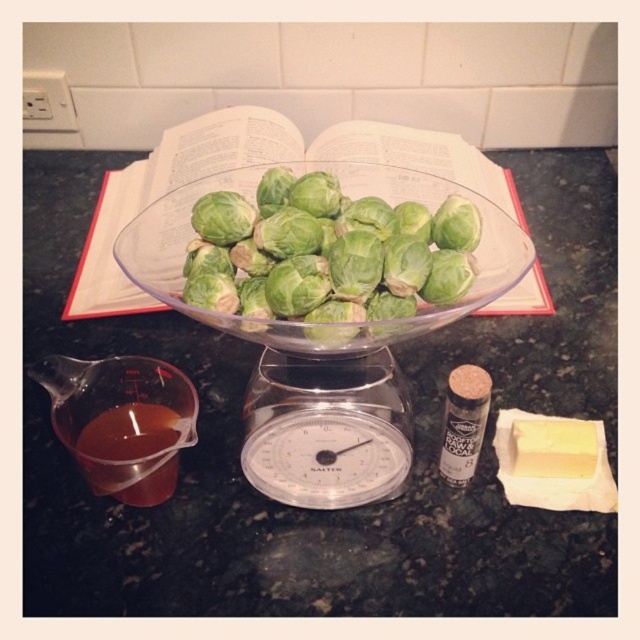
Question: Which point appears farthest from the camera in this image?

Choices:
 (A) (148, 394)
 (B) (506, 250)
 (C) (156, 445)
 (D) (291, 504)

Answer: (A)

Question: Does transparent plastic at center appear under translucent plastic measuring cup at lower left?

Choices:
 (A) yes
 (B) no

Answer: (A)

Question: Can you confirm if green leafy brussels sprouts at center is positioned below translucent amber liquid at lower left?

Choices:
 (A) no
 (B) yes

Answer: (A)

Question: Estimate the real-world distances between objects in this image. Which object is closer to the green leafy brussels sprouts at center?

Choices:
 (A) transparent plastic at center
 (B) green paper at center
 (C) translucent amber liquid at lower left

Answer: (A)

Question: Which of these objects is positioned farthest from the transparent plastic at center?

Choices:
 (A) translucent amber liquid at lower left
 (B) translucent plastic measuring cup at lower left

Answer: (A)

Question: Considering the relative positions of green leafy brussels sprouts at center and translucent plastic measuring cup at lower left in the image provided, where is green leafy brussels sprouts at center located with respect to translucent plastic measuring cup at lower left?

Choices:
 (A) above
 (B) below

Answer: (A)